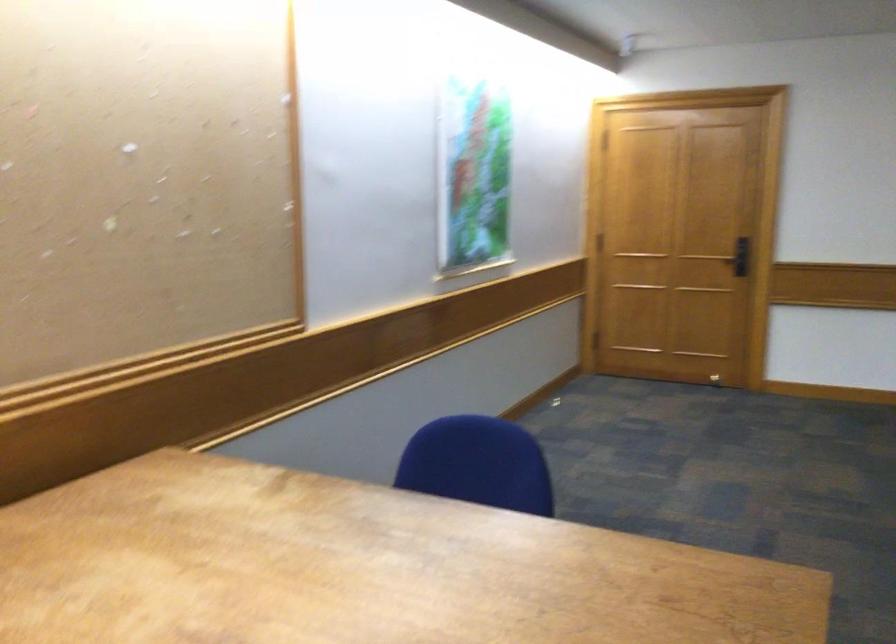
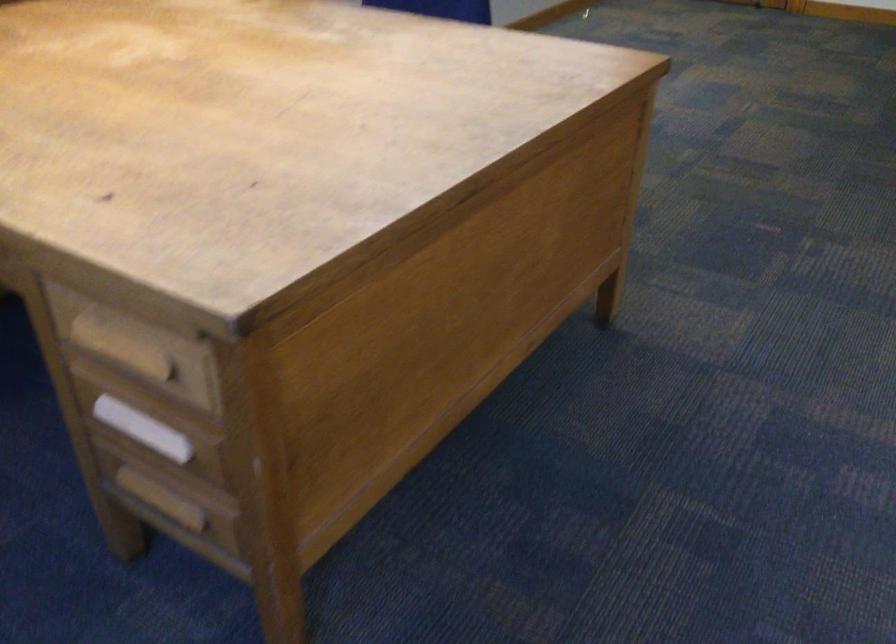
Based on the photo, in a continuous first-person perspective shot, in which direction is the camera moving?

The movement direction of the cameraman is right, backward.